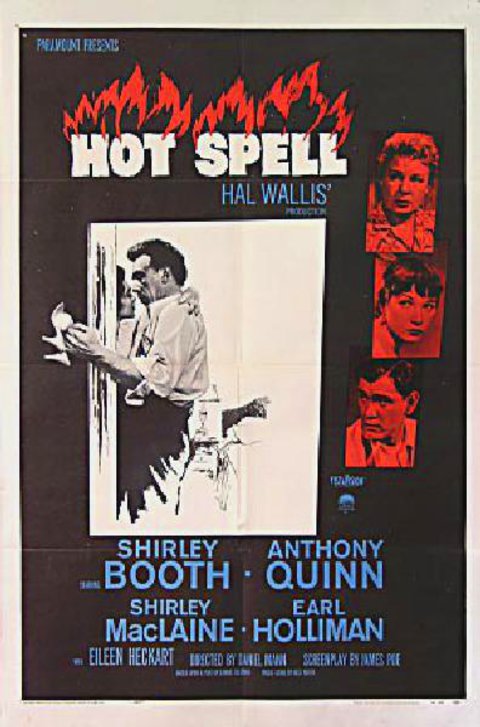
The height and width of the screenshot is (727, 480). Identify the location of movie poster for hot spell. (433, 520).